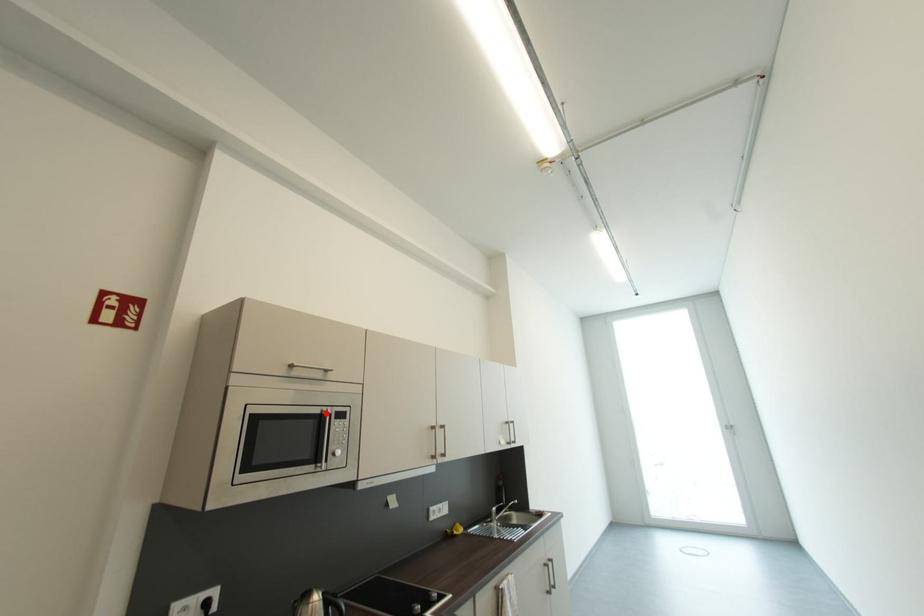
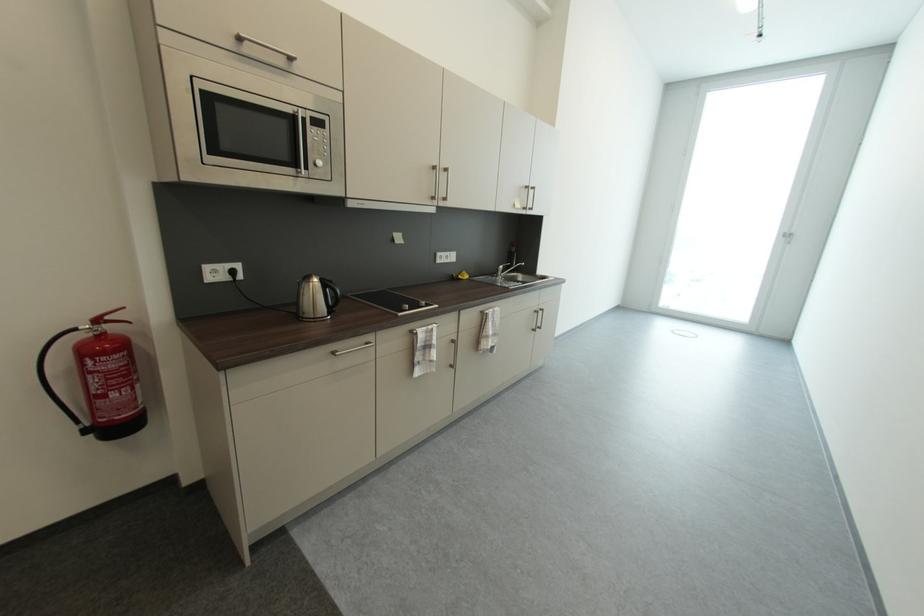
Locate, in the second image, the point that corresponds to the highlighted location in the first image.

(297, 113)